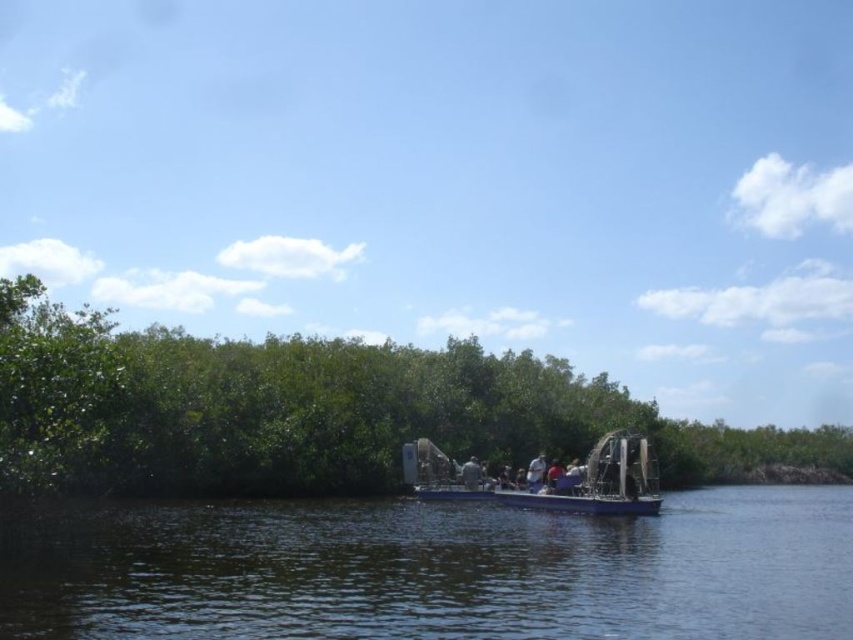
Which of these two, dark blue water at center or blue fabric shirt at center, stands shorter?

blue fabric shirt at center is shorter.

Is dark blue water at center positioned in front of blue fabric shirt at center?

That is True.

Is point (250, 627) less distant than point (561, 465)?

Yes.

Locate an element on the screen. This screenshot has height=640, width=853. dark blue water at center is located at coordinates (442, 572).

Is green leafy trees at center to the left of light brown leather jacket at center from the viewer's perspective?

In fact, green leafy trees at center is to the right of light brown leather jacket at center.

Based on the photo, which is below, green leafy trees at center or light brown leather jacket at center?

Positioned lower is green leafy trees at center.

Where is `green leafy trees at center`? green leafy trees at center is located at coordinates (315, 410).

Is point (543, 458) positioned in front of point (553, 488)?

No, (543, 458) is behind (553, 488).

Locate an element on the screen. The width and height of the screenshot is (853, 640). light brown leather jacket at center is located at coordinates (535, 472).